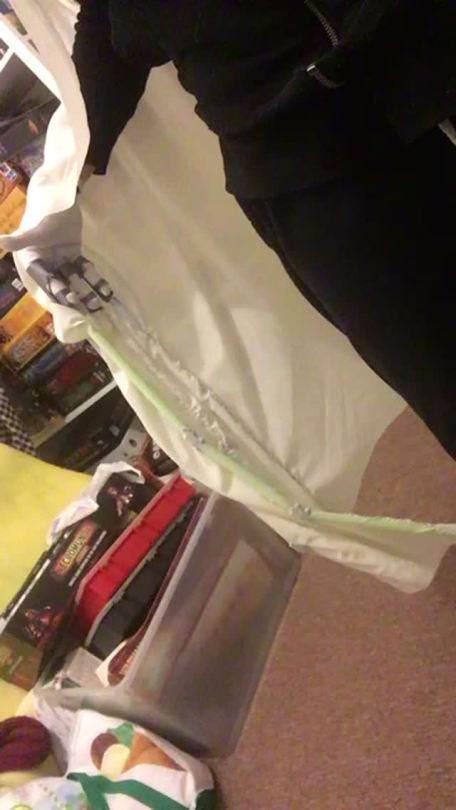
The height and width of the screenshot is (810, 456). I want to click on brown carpet, so point(336,755).